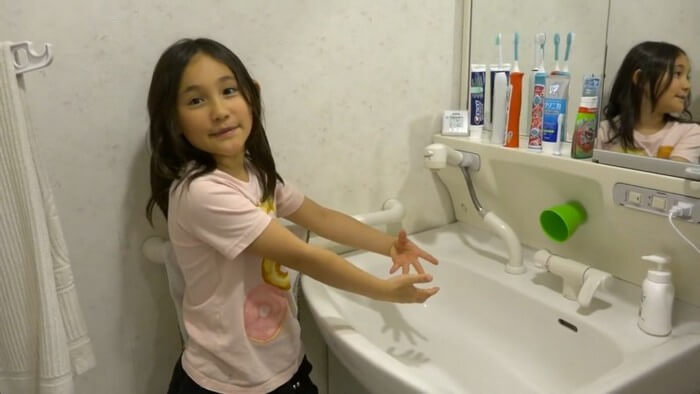
You are a GUI agent. You are given a task and a screenshot of the screen. Output one action in this format:
    pyautogui.click(x=<x>, y=<y>)
    Task: Click on the pump bottle white
    Image resolution: width=700 pixels, height=394 pixels.
    Given the screenshot: What is the action you would take?
    pyautogui.click(x=652, y=301)